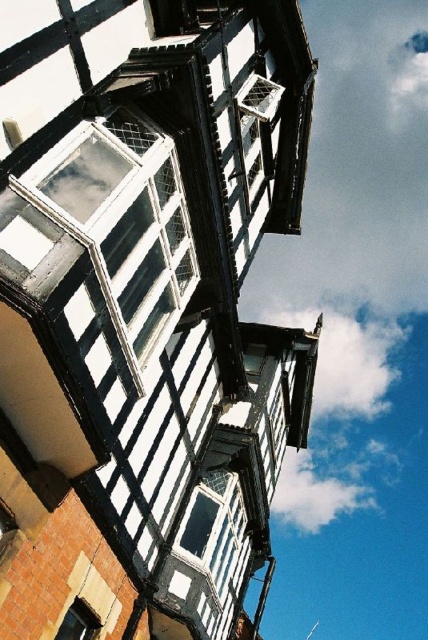
Measure the distance between white painted wood window at upper left and white mesh window at upper center.

white painted wood window at upper left and white mesh window at upper center are 5.63 meters apart.

Is white painted wood window at upper left wider than white mesh window at upper center?

Correct, the width of white painted wood window at upper left exceeds that of white mesh window at upper center.

Locate an element on the screen. The image size is (428, 640). white painted wood window at upper left is located at coordinates (122, 225).

Is white painted wood window at upper left to the right of white fluffy cloud at upper center from the viewer's perspective?

In fact, white painted wood window at upper left is to the left of white fluffy cloud at upper center.

Is white painted wood window at upper left below white fluffy cloud at upper center?

No.

Describe the element at coordinates (122, 225) in the screenshot. I see `white painted wood window at upper left` at that location.

Where is `white painted wood window at upper left`? The image size is (428, 640). white painted wood window at upper left is located at coordinates [x=122, y=225].

How much distance is there between white painted wood window at upper left and matte black window at lower left?

They are 5.38 meters apart.

Between point (14, 188) and point (92, 636), which one is positioned behind?

Positioned behind is point (92, 636).

Does point (158, 312) come behind point (71, 636)?

Yes, point (158, 312) is behind point (71, 636).

Where is `white painted wood window at upper left`? white painted wood window at upper left is located at coordinates (122, 225).